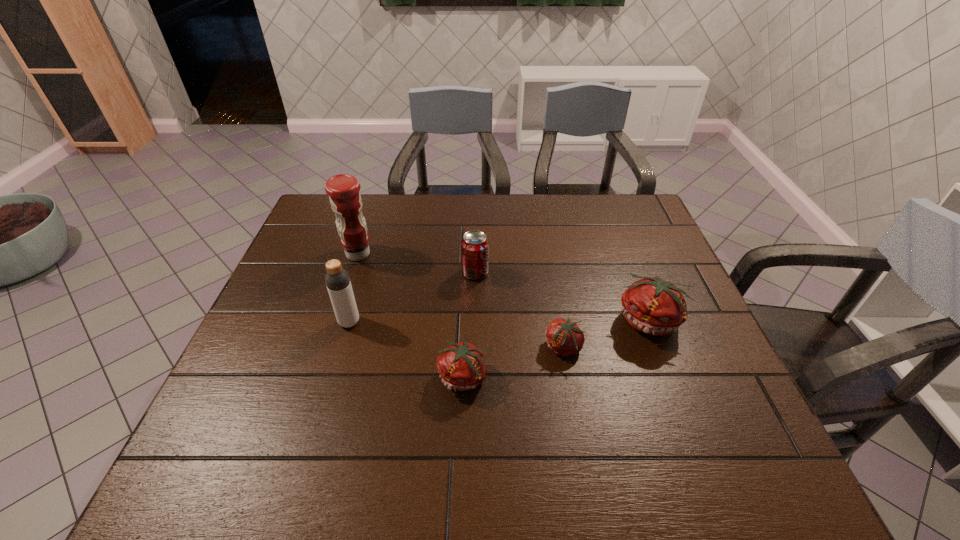
This screenshot has width=960, height=540. In the image, there is a desktop. What are the coordinates of `free space at the left edge` in the screenshot? It's located at (298, 257).

Locate an element on the screen. free spot at the right edge of the desktop is located at coordinates (684, 291).

Identify the location of vacant space at the far right corner of the desktop. (610, 222).

You are a GUI agent. You are given a task and a screenshot of the screen. Output one action in this format:
    pyautogui.click(x=<x>, y=<y>)
    Task: Click on the free space that is in between the soda can and the leftmost tomato
    The image size is (960, 540).
    Given the screenshot: What is the action you would take?
    pos(470,325)

At what (x,y) coordinates should I click in order to perform the action: click on empty space between the rightmost tomato and the soda can. Please return your answer as a coordinate pair (x, y). Looking at the image, I should click on (563, 297).

Where is `free space that is in between the soda can and the bottle`? free space that is in between the soda can and the bottle is located at coordinates (412, 298).

This screenshot has width=960, height=540. Find the location of `free spot between the second tallest tomato and the fifth shortest object`. free spot between the second tallest tomato and the fifth shortest object is located at coordinates (407, 349).

The width and height of the screenshot is (960, 540). What are the coordinates of `vacant point located between the condiment and the second shortest object` in the screenshot? It's located at (412, 315).

The image size is (960, 540). What are the coordinates of `vacant region between the tallest object and the leftmost tomato` in the screenshot? It's located at (412, 315).

Locate an element on the screen. vacant region between the condiment and the soda can is located at coordinates (417, 264).